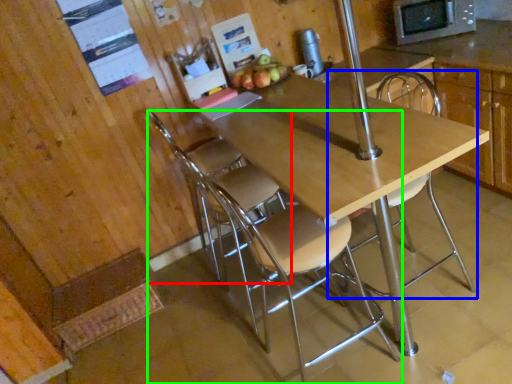
Question: Which is nearer to the chair (highlighted by a red box)? chair (highlighted by a blue box) or chair (highlighted by a green box).

Choices:
 (A) chair
 (B) chair

Answer: (B)